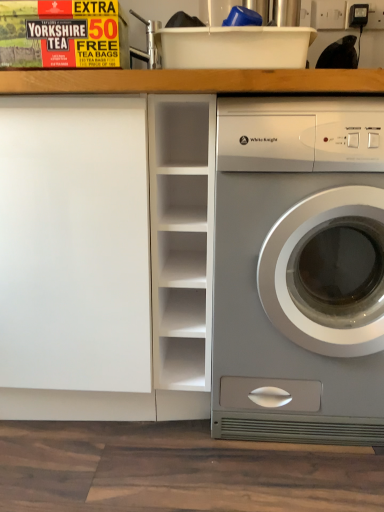
In order to click on white matte bookshelf at center in this screenshot , I will do `click(182, 250)`.

What do you see at coordinates (182, 250) in the screenshot?
I see `white matte bookshelf at center` at bounding box center [182, 250].

Identify the location of satin silver washer at right. (299, 270).

The height and width of the screenshot is (512, 384). Describe the element at coordinates (299, 270) in the screenshot. I see `satin silver washer at right` at that location.

Identify the location of white matte bookshelf at center. (182, 250).

Considering the relative positions of white matte bookshelf at center and satin silver washer at right in the image provided, is white matte bookshelf at center to the right of satin silver washer at right from the viewer's perspective?

In fact, white matte bookshelf at center is to the left of satin silver washer at right.

In the image, is white matte bookshelf at center positioned in front of or behind satin silver washer at right?

In the image, white matte bookshelf at center appears behind satin silver washer at right.

In the scene shown: Which point is more forward, [210,130] or [244,392]?

The point [210,130] is closer to the camera.

In the scene shown: From the image's perspective, is white matte bookshelf at center on satin silver washer at right?

Correct, white matte bookshelf at center appears higher than satin silver washer at right in the image.

From a real-world perspective, which is physically above, white matte bookshelf at center or satin silver washer at right?

white matte bookshelf at center, from a real-world perspective.

Based on the photo, is white matte bookshelf at center wider or thinner than satin silver washer at right?

Considering their sizes, white matte bookshelf at center looks broader than satin silver washer at right.

Who is taller, white matte bookshelf at center or satin silver washer at right?

Standing taller between the two is satin silver washer at right.

From the picture: Can you confirm if white matte bookshelf at center is bigger than satin silver washer at right?

Incorrect, white matte bookshelf at center is not larger than satin silver washer at right.

Would you say white matte bookshelf at center is inside or outside satin silver washer at right?

white matte bookshelf at center lies outside satin silver washer at right.

Looking at this image, is white matte bookshelf at center beside satin silver washer at right?

white matte bookshelf at center is not next to satin silver washer at right, and they're not touching.

Is white matte bookshelf at center oriented towards satin silver washer at right?

No, white matte bookshelf at center is not facing towards satin silver washer at right.

Can you tell me how much white matte bookshelf at center and satin silver washer at right differ in facing direction?

0.862 degrees.

Where is `washing machine that appears on the right of white matte bookshelf at center`? This screenshot has height=512, width=384. washing machine that appears on the right of white matte bookshelf at center is located at coordinates (299, 270).

Considering the positions of objects satin silver washer at right and white matte bookshelf at center in the image provided, who is more to the right, satin silver washer at right or white matte bookshelf at center?

satin silver washer at right is more to the right.

Considering the positions of objects satin silver washer at right and white matte bookshelf at center in the image provided, who is behind, satin silver washer at right or white matte bookshelf at center?

white matte bookshelf at center.

Is point (343, 215) less distant than point (154, 170)?

Yes, it is.

From the image's perspective, which one is positioned higher, satin silver washer at right or white matte bookshelf at center?

white matte bookshelf at center.

From a real-world perspective, does satin silver washer at right stand above white matte bookshelf at center?

No, from a real-world perspective, satin silver washer at right is not over white matte bookshelf at center

Considering the relative sizes of satin silver washer at right and white matte bookshelf at center in the image provided, is satin silver washer at right wider than white matte bookshelf at center?

Incorrect, the width of satin silver washer at right does not surpass that of white matte bookshelf at center.

In the scene shown: From their relative heights in the image, would you say satin silver washer at right is taller or shorter than white matte bookshelf at center?

In the image, satin silver washer at right appears to be taller than white matte bookshelf at center.

Between satin silver washer at right and white matte bookshelf at center, which one has larger size?

Bigger between the two is satin silver washer at right.

In the scene shown: Is white matte bookshelf at center completely or partially inside satin silver washer at right?

No, satin silver washer at right does not contain white matte bookshelf at center.

Is satin silver washer at right with white matte bookshelf at center?

No, satin silver washer at right is not with white matte bookshelf at center.

Based on the photo, is satin silver washer at right turned away from white matte bookshelf at center?

No, satin silver washer at right's orientation is not away from white matte bookshelf at center.

Where is `bookshelf on the left of satin silver washer at right`? This screenshot has height=512, width=384. bookshelf on the left of satin silver washer at right is located at coordinates point(182,250).

You are a GUI agent. You are given a task and a screenshot of the screen. Output one action in this format:
    pyautogui.click(x=<x>, y=<y>)
    Task: Click on the washing machine that is below the white matte bookshelf at center (from the image's perspective)
    
    Given the screenshot: What is the action you would take?
    pyautogui.click(x=299, y=270)

The width and height of the screenshot is (384, 512). What are the coordinates of `bookshelf on the left of satin silver washer at right` in the screenshot? It's located at (182, 250).